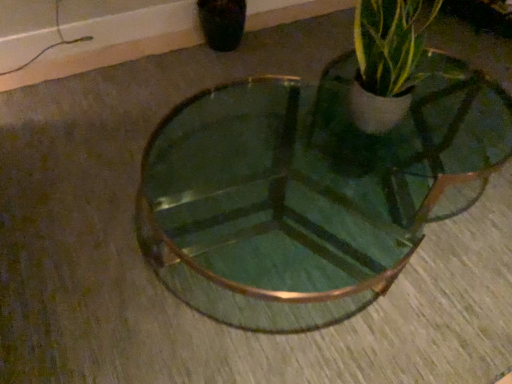
Describe the element at coordinates (308, 192) in the screenshot. I see `transparent glass table at center` at that location.

At what (x,y) coordinates should I click in order to perform the action: click on transparent glass table at center. Please return your answer as a coordinate pair (x, y). This screenshot has width=512, height=384. Looking at the image, I should click on [308, 192].

This screenshot has height=384, width=512. Identify the location of transparent glass table at center. (308, 192).